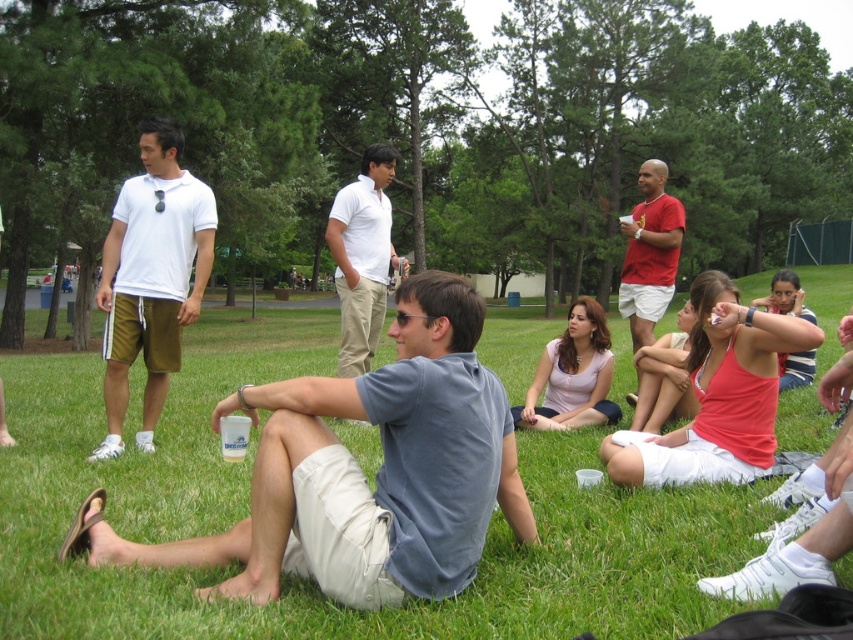
Question: Which point is farther from the camera taking this photo?

Choices:
 (A) (x=643, y=188)
 (B) (x=380, y=189)
 (C) (x=187, y=298)
 (D) (x=165, y=563)

Answer: (A)

Question: Which object appears farthest from the camera in this image?

Choices:
 (A) matte red t-shirt at center
 (B) gray cotton shirt at center

Answer: (A)

Question: Estimate the real-world distances between objects in this image. Which object is closer to the white cotton shirt at center?

Choices:
 (A) white cotton polo shirt at left
 (B) matte red t-shirt at center
 (C) gray cotton shirt at center

Answer: (C)

Question: In this image, where is gray cotton shirt at center located relative to matte red t-shirt at center?

Choices:
 (A) right
 (B) left

Answer: (B)

Question: Is white cotton shirt at center bigger than matte red t-shirt at center?

Choices:
 (A) no
 (B) yes

Answer: (B)

Question: Where is white cotton shirt at center located in relation to matte red t-shirt at center in the image?

Choices:
 (A) above
 (B) below

Answer: (B)